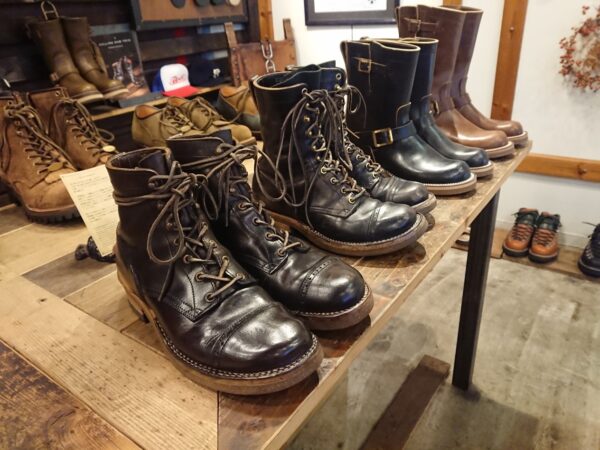
You are a GUI agent. You are given a task and a screenshot of the screen. Output one action in this format:
    pyautogui.click(x=<x>, y=<y>)
    Task: Click on the wreath
    
    Given the screenshot: What is the action you would take?
    pyautogui.click(x=586, y=61)